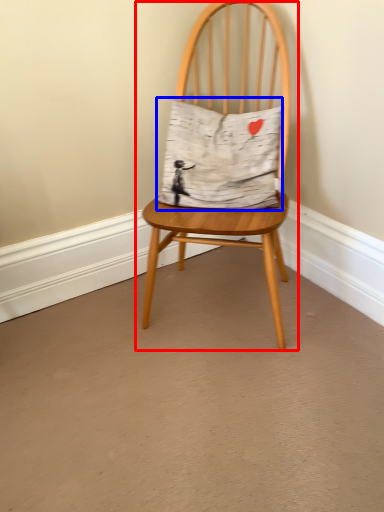
Question: Among these objects, which one is farthest to the camera, chair (highlighted by a red box) or pillow (highlighted by a blue box)?

Choices:
 (A) chair
 (B) pillow

Answer: (B)